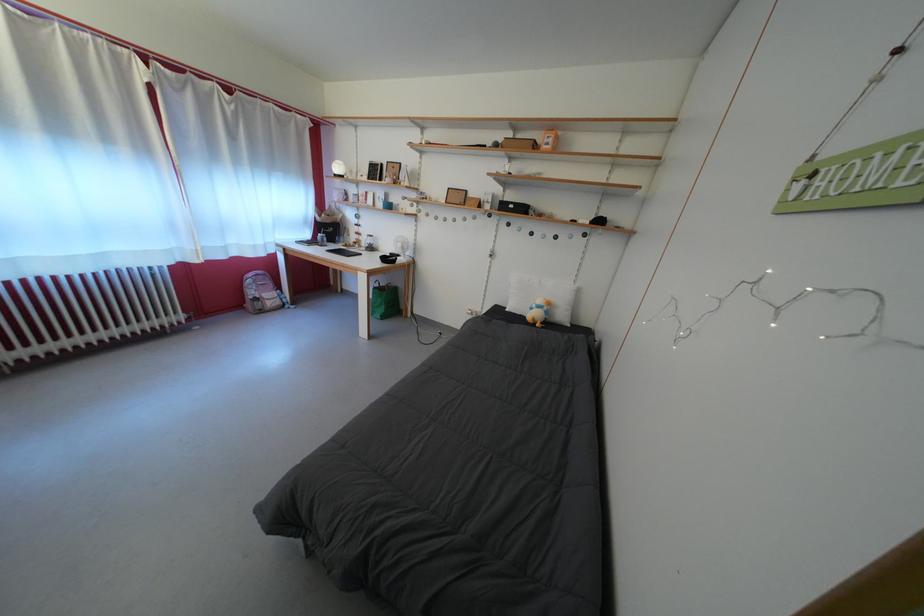
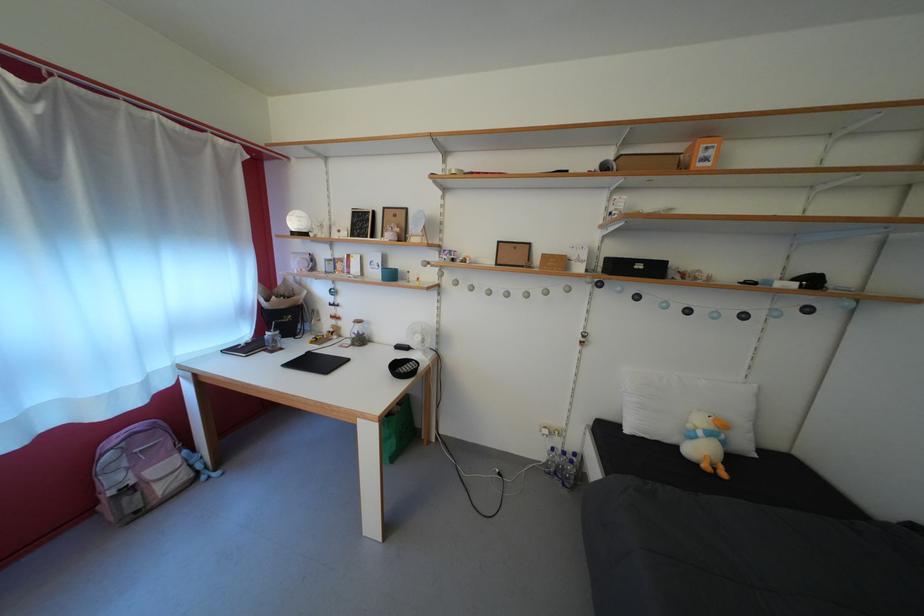
In the second image, find the point that corresponds to (554,318) in the first image.

(732, 448)